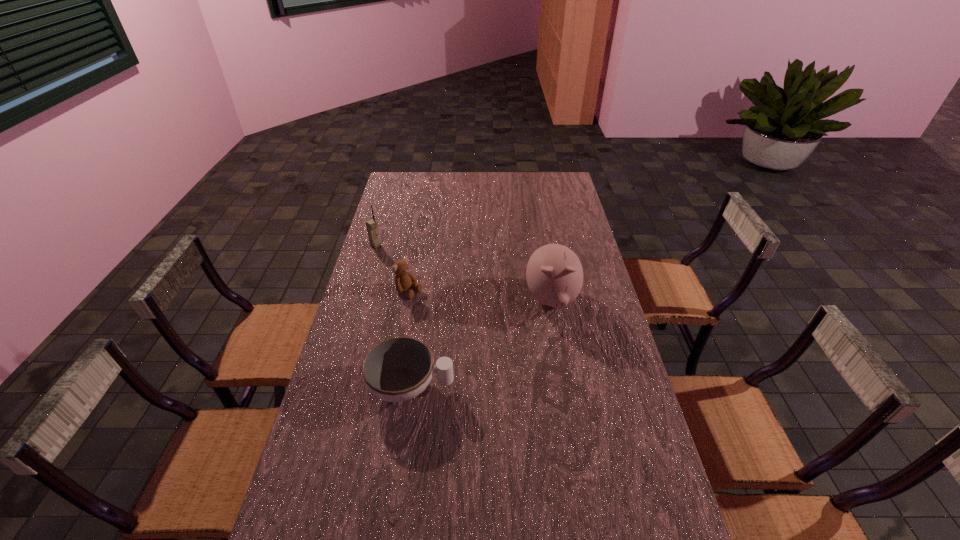
Locate an element on the screen. vacant space situated on the front-facing side of the teddy bear is located at coordinates (494, 339).

At what (x,y) coordinates should I click in order to perform the action: click on vacant space located 0.120m on the front of the farthest object, where the keypad is located. Please return your answer as a coordinate pair (x, y). Looking at the image, I should click on (396, 261).

What are the coordinates of `free space located 0.160m on the front of the farthest object, where the keypad is located` in the screenshot? It's located at [x=403, y=266].

This screenshot has width=960, height=540. In order to click on free location located on the front of the farthest object, where the keypad is located in this screenshot , I will do `click(399, 264)`.

Where is `chinaware that is at the left edge`? chinaware that is at the left edge is located at coordinates (399, 369).

This screenshot has height=540, width=960. I want to click on teddy bear that is at the left edge, so click(403, 279).

I want to click on cellular telephone located at the left edge, so click(x=371, y=225).

The image size is (960, 540). What are the coordinates of `object located at the right edge` in the screenshot? It's located at (554, 273).

In the image, there is a desktop. Where is `free space at the far edge`? free space at the far edge is located at coordinates (499, 178).

You are a GUI agent. You are given a task and a screenshot of the screen. Output one action in this format:
    pyautogui.click(x=<x>, y=<y>)
    Task: Click on the free space at the near edge of the desktop
    This screenshot has width=960, height=540.
    Given the screenshot: What is the action you would take?
    pyautogui.click(x=405, y=522)